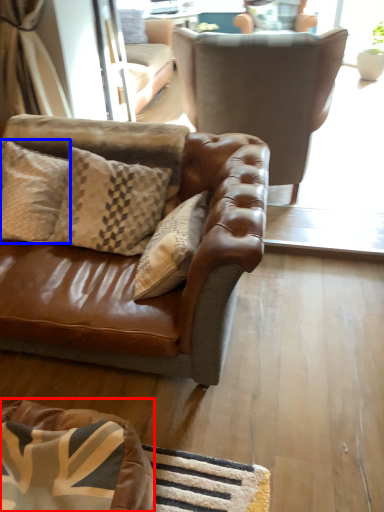
Question: Which of the following is the farthest to the observer, dog bed (highlighted by a red box) or pillow (highlighted by a blue box)?

Choices:
 (A) dog bed
 (B) pillow

Answer: (B)